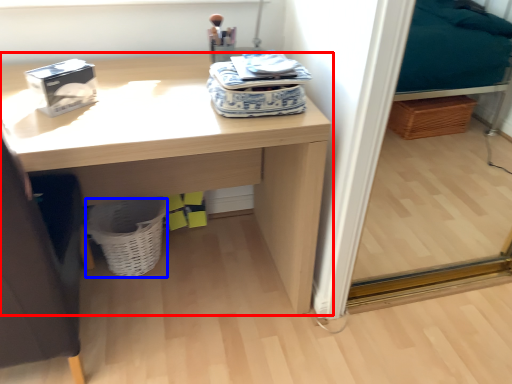
Question: Which object appears farthest to the camera in this image, desk (highlighted by a red box) or basket (highlighted by a blue box)?

Choices:
 (A) desk
 (B) basket

Answer: (B)